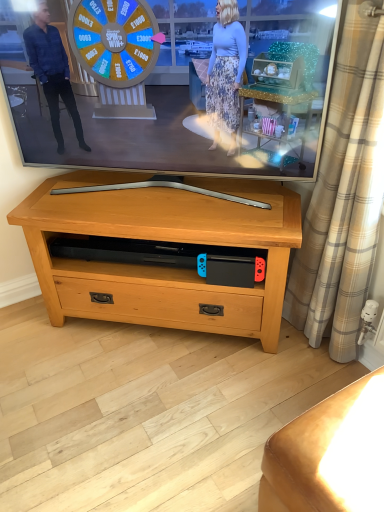
Where is `empty space that is ontop of leather couch at lower right (from a real-world perspective)`? empty space that is ontop of leather couch at lower right (from a real-world perspective) is located at coordinates (345, 437).